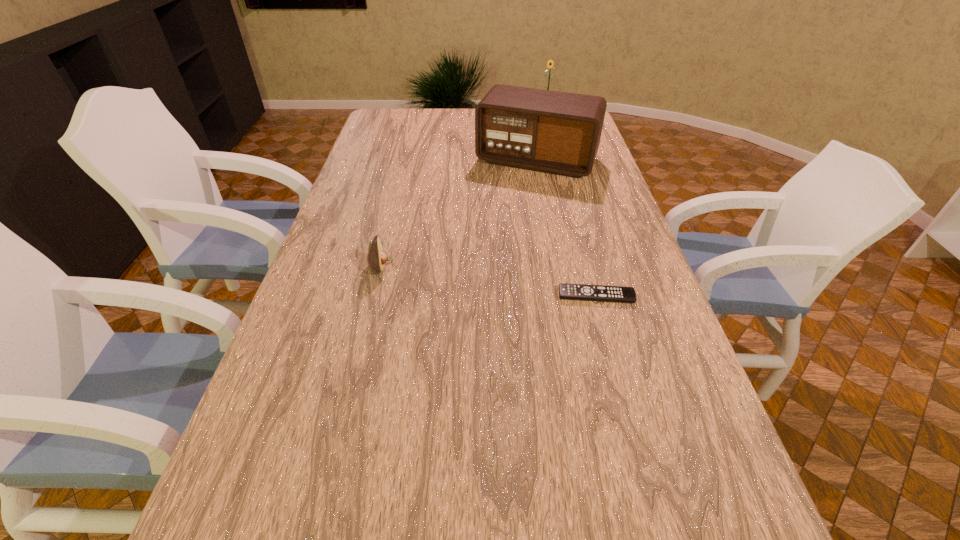
Locate an element on the screen. The width and height of the screenshot is (960, 540). the second nearest object is located at coordinates (377, 257).

In order to click on avocado in this screenshot , I will do `click(377, 257)`.

I want to click on the shortest object, so click(x=566, y=291).

Locate an element on the screen. The width and height of the screenshot is (960, 540). the nearest object is located at coordinates (566, 291).

Identify the location of the second farthest object. The image size is (960, 540). (554, 132).

The width and height of the screenshot is (960, 540). I want to click on the farthest object, so click(x=550, y=63).

At what (x,y) coordinates should I click in order to perform the action: click on vacant space located on the seed side of the leftmost object. Please return your answer as a coordinate pair (x, y). The height and width of the screenshot is (540, 960). Looking at the image, I should click on click(491, 266).

The image size is (960, 540). What are the coordinates of `vacant space located 0.320m on the front of the shortest object` in the screenshot? It's located at pyautogui.click(x=630, y=422).

The height and width of the screenshot is (540, 960). Identify the location of free region located on the front-facing side of the radio receiver. pos(502,215).

Identify the location of vacant area situated on the front-facing side of the radio receiver. The width and height of the screenshot is (960, 540). (486, 246).